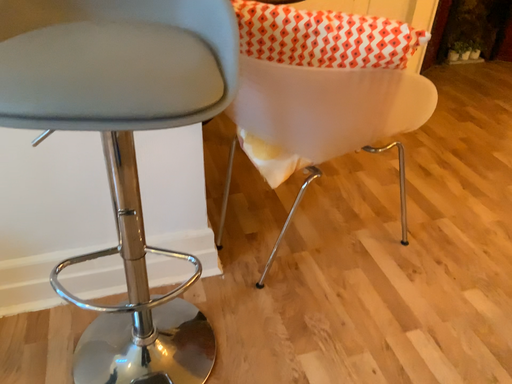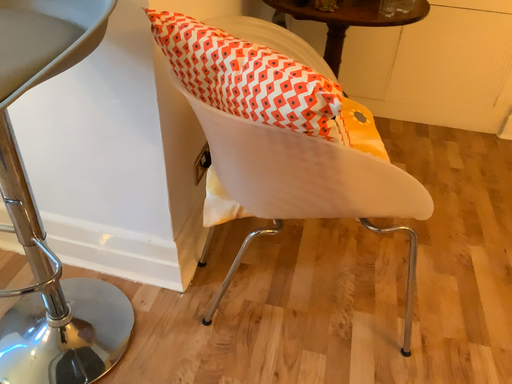
Question: Which way did the camera rotate in the video?

Choices:
 (A) rotated left
 (B) rotated right

Answer: (A)